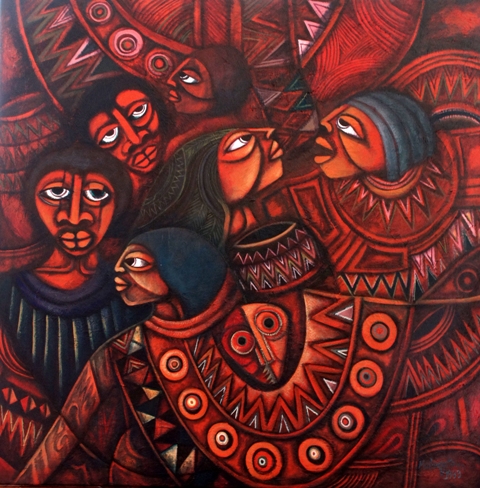
Where is `jar`? Image resolution: width=480 pixels, height=488 pixels. jar is located at coordinates (265, 257).